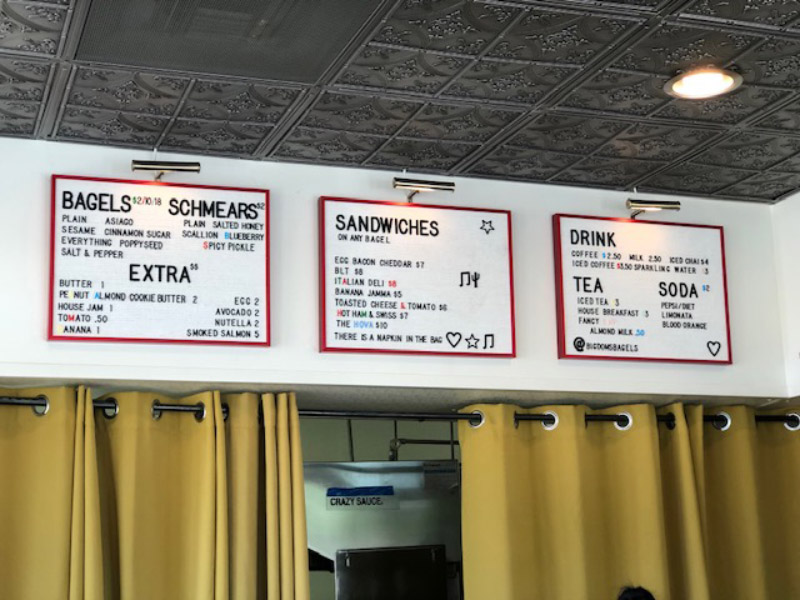
The width and height of the screenshot is (800, 600). What are the coordinates of `ceiling` in the screenshot? It's located at (534, 134).